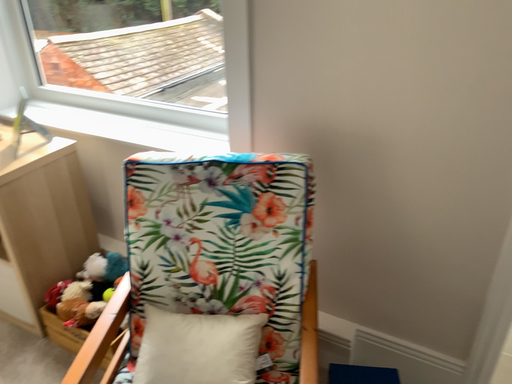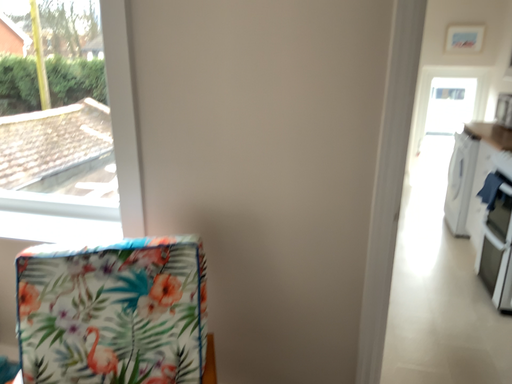
Question: Which way did the camera rotate in the video?

Choices:
 (A) rotated downward
 (B) rotated upward

Answer: (B)